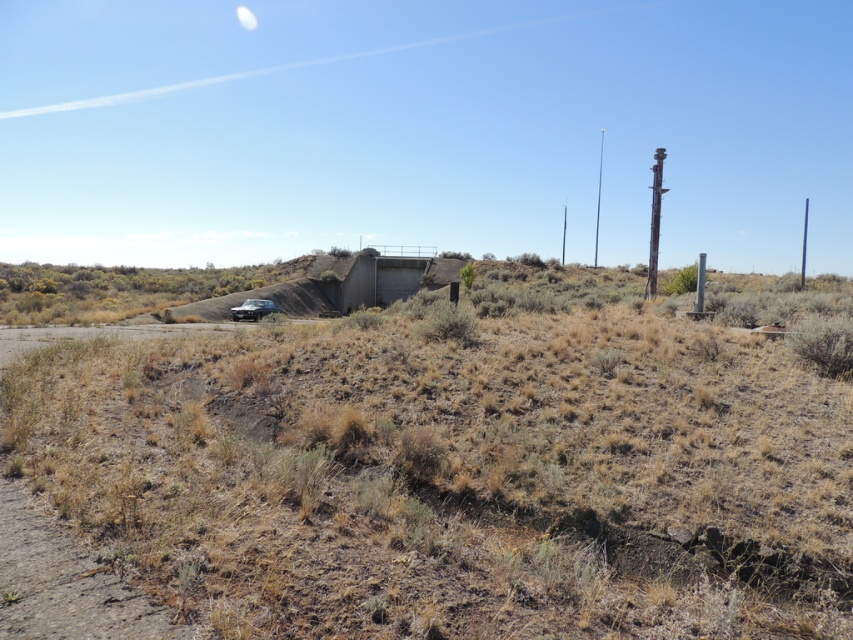
Question: Which point appears closest to the camera in this image?

Choices:
 (A) (262, 314)
 (B) (480, 609)
 (C) (602, 141)

Answer: (B)

Question: Can you confirm if weathered wood telegraph pole at right is positioned below metallic silver car at center?

Choices:
 (A) yes
 (B) no

Answer: (B)

Question: Among these points, which one is nearest to the camera?

Choices:
 (A) (257, 304)
 (B) (595, 246)

Answer: (A)

Question: Can you confirm if weathered wood telegraph pole at right is positioned below wooden telegraph pole at right?

Choices:
 (A) no
 (B) yes

Answer: (B)

Question: Is brown dirt embankment at center above wooden telegraph pole at right?

Choices:
 (A) no
 (B) yes

Answer: (A)

Question: Based on their relative distances, which object is nearer to the brown dirt embankment at center?

Choices:
 (A) weathered wood telegraph pole at right
 (B) metallic silver car at center
 (C) wooden telegraph pole at right

Answer: (A)